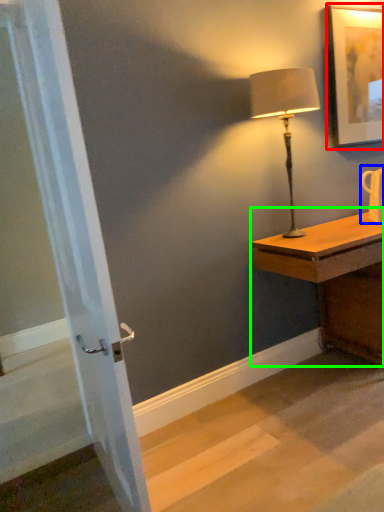
Question: Which object is positioned farthest from picture frame (highlighted by a red box)? Select from mug (highlighted by a blue box) and desk (highlighted by a green box).

Choices:
 (A) mug
 (B) desk

Answer: (B)